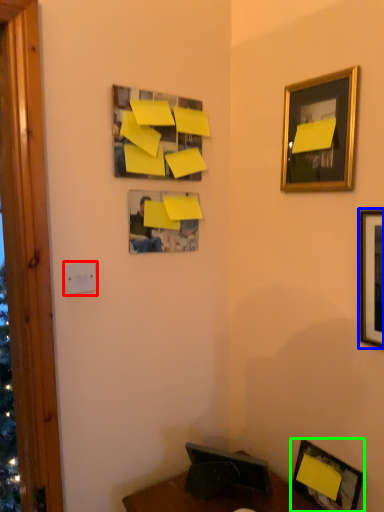
Question: Which object is the closest to the light switch (highlighted by a red box)? Choose among these: picture frame (highlighted by a blue box) or picture frame (highlighted by a green box).

Choices:
 (A) picture frame
 (B) picture frame

Answer: (A)